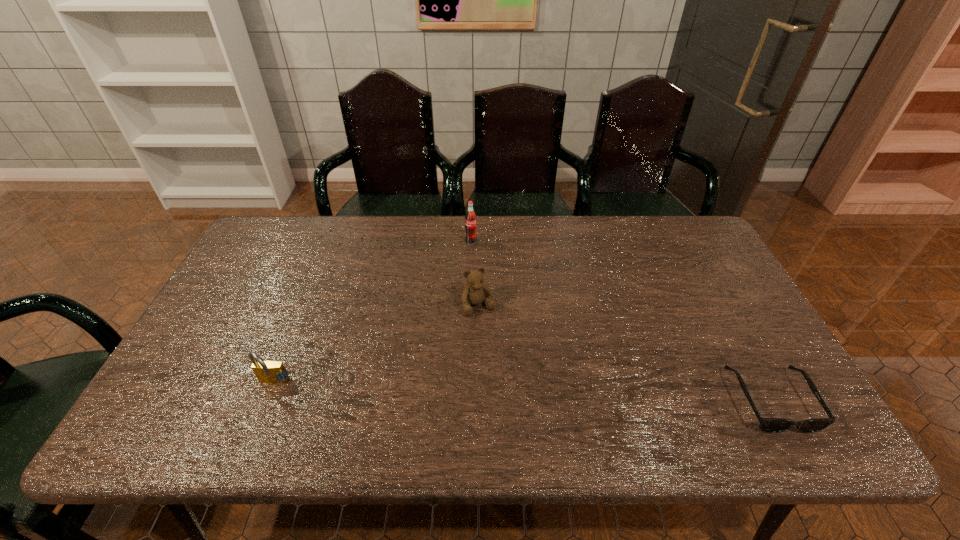
Identify which object is located as the second nearest to the leftmost object. Please provide its 2D coordinates. Your answer should be formatted as a tuple, i.e. [(x, y)], where the tuple contains the x and y coordinates of a point satisfying the conditions above.

[(470, 218)]

Locate an element on the screen. The width and height of the screenshot is (960, 540). object identified as the third closest to the padlock is located at coordinates (768, 425).

The image size is (960, 540). Find the location of `vacant point that satisfies the following two spatial constraints: 1. on the front side of the teddy bear; 2. on the left side of the tallest object`. vacant point that satisfies the following two spatial constraints: 1. on the front side of the teddy bear; 2. on the left side of the tallest object is located at coordinates (469, 306).